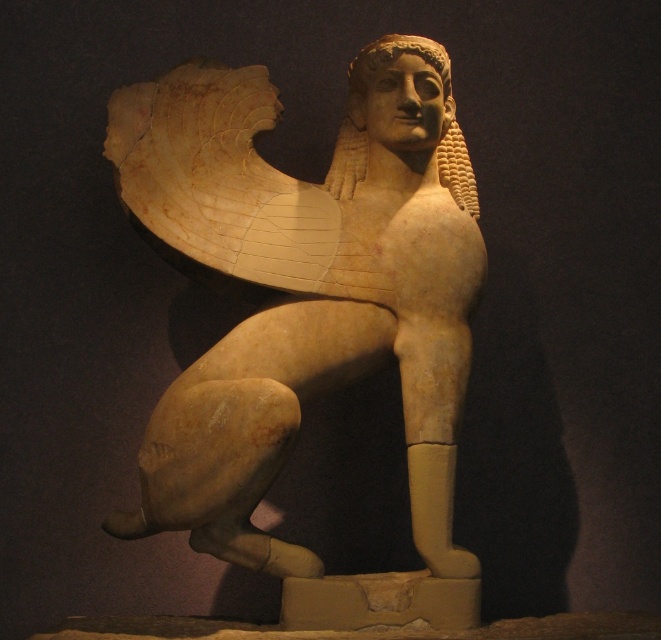
You are an archaeologist examining the ancient stone sculptures in the image. You see the beige stone sphinx at center and the golden stone head at center. Which object is located above the other?

The golden stone head at center is above the beige stone sphinx at center because the beige stone sphinx at center is positioned under the golden stone head at center.

You are an art conservator examining the ancient stone sculpture. You notice two parts of the sculpture labeled as the beige stone sphinx at center and the golden stone head at center. Which part of the sculpture is taller?

The beige stone sphinx at center is taller than the golden stone head at center.